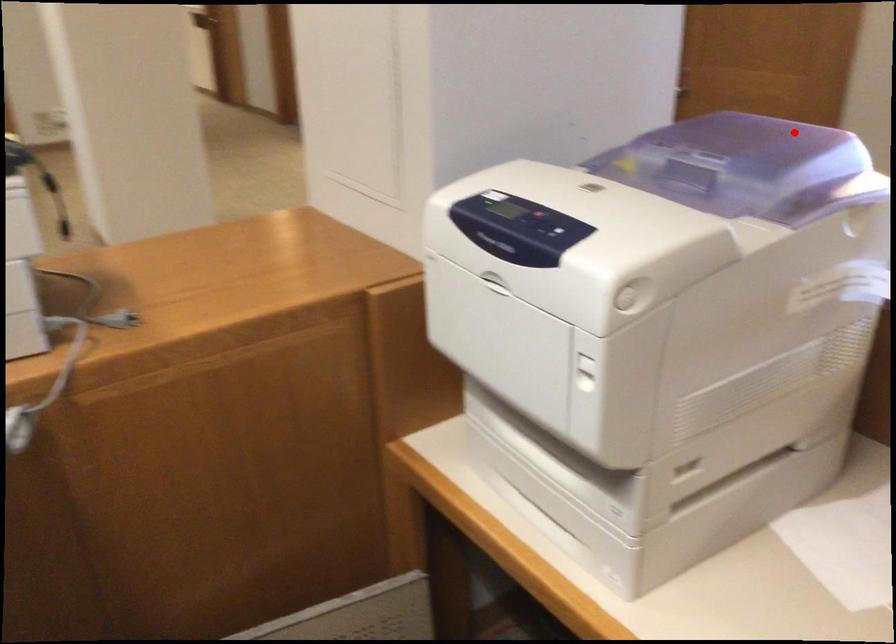
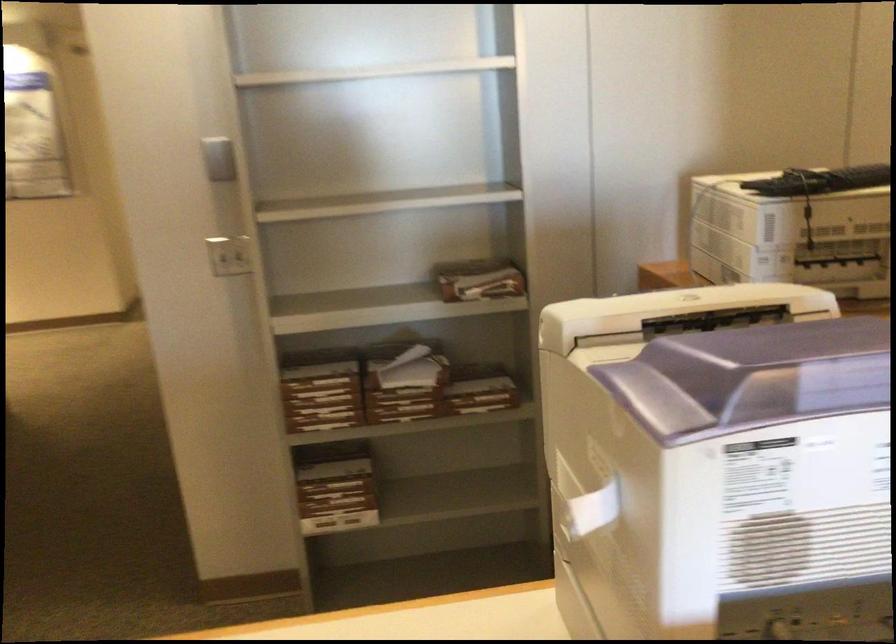
In the second image, find the point that corresponds to the highlighted location in the first image.

(780, 368)